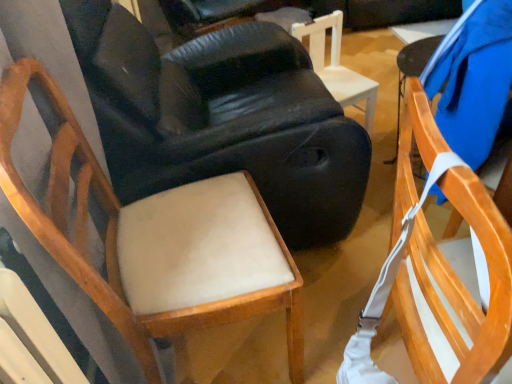
Question: Considering the relative sizes of light brown wood chair at left, which appears as the 4th chair when viewed from the right, and wooden chair with white straps at right, the first chair positioned from the right, in the image provided, is light brown wood chair at left, which appears as the 4th chair when viewed from the right, smaller than wooden chair with white straps at right, the first chair positioned from the right,?

Choices:
 (A) yes
 (B) no

Answer: (A)

Question: From the image's perspective, is light brown wood chair at left, which ranks as the first chair in left-to-right order, above wooden chair with white straps at right, the fourth chair viewed from the left?

Choices:
 (A) yes
 (B) no

Answer: (A)

Question: Is light brown wood chair at left, which ranks as the first chair in left-to-right order, wider than wooden chair with white straps at right, the first chair positioned from the right?

Choices:
 (A) yes
 (B) no

Answer: (B)

Question: From the image's perspective, does light brown wood chair at left, which ranks as the first chair in left-to-right order, appear lower than wooden chair with white straps at right, the fourth chair viewed from the left?

Choices:
 (A) yes
 (B) no

Answer: (B)

Question: Does light brown wood chair at left, which ranks as the first chair in left-to-right order, come behind wooden chair with white straps at right, the first chair positioned from the right?

Choices:
 (A) no
 (B) yes

Answer: (B)

Question: Does light brown wood chair at left, which appears as the 4th chair when viewed from the right, appear on the left side of wooden chair with white straps at right, the first chair positioned from the right?

Choices:
 (A) yes
 (B) no

Answer: (A)

Question: Is the depth of white wood chair at center, which is counted as the 3th chair, starting from the left, greater than that of light beige fabric chair at center, which is the 2th chair in left-to-right order?

Choices:
 (A) yes
 (B) no

Answer: (A)

Question: Is white wood chair at center, marked as the second chair in a right-to-left arrangement, turned away from light beige fabric chair at center, the third chair when ordered from right to left?

Choices:
 (A) yes
 (B) no

Answer: (B)

Question: From the image's perspective, is white wood chair at center, marked as the second chair in a right-to-left arrangement, below light beige fabric chair at center, which is the 2th chair in left-to-right order?

Choices:
 (A) no
 (B) yes

Answer: (A)

Question: Is white wood chair at center, marked as the second chair in a right-to-left arrangement, bigger than light beige fabric chair at center, which is the 2th chair in left-to-right order?

Choices:
 (A) no
 (B) yes

Answer: (A)

Question: From a real-world perspective, is white wood chair at center, which is counted as the 3th chair, starting from the left, physically above light beige fabric chair at center, which is the 2th chair in left-to-right order?

Choices:
 (A) yes
 (B) no

Answer: (B)

Question: Is white wood chair at center, which is counted as the 3th chair, starting from the left, shorter than light beige fabric chair at center, the third chair when ordered from right to left?

Choices:
 (A) no
 (B) yes

Answer: (B)

Question: From the image's perspective, would you say wooden chair with white straps at right, the first chair positioned from the right, is positioned over light brown wood chair at left, which appears as the 4th chair when viewed from the right?

Choices:
 (A) yes
 (B) no

Answer: (B)